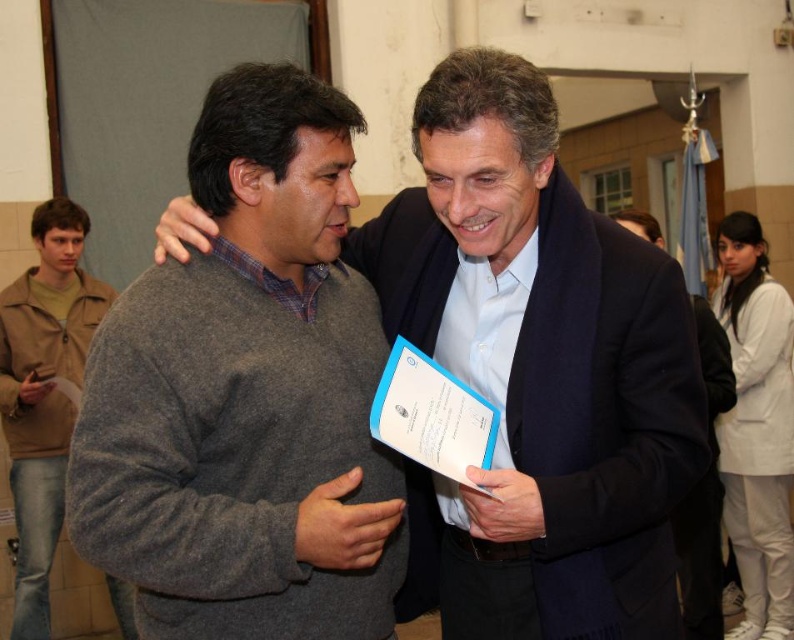
Question: Estimate the real-world distances between objects in this image. Which object is farther from the brown leather jacket at left?

Choices:
 (A) gray wool sweater at center
 (B) gray wool sweater at left

Answer: (A)

Question: Does gray wool sweater at left have a greater width compared to gray wool sweater at center?

Choices:
 (A) no
 (B) yes

Answer: (A)

Question: Does gray wool sweater at left have a greater width compared to brown leather jacket at left?

Choices:
 (A) no
 (B) yes

Answer: (B)

Question: Which is farther from the brown leather jacket at left?

Choices:
 (A) gray wool sweater at center
 (B) gray wool sweater at left

Answer: (A)

Question: Is gray wool sweater at center smaller than brown leather jacket at left?

Choices:
 (A) no
 (B) yes

Answer: (A)

Question: Which is nearer to the brown leather jacket at left?

Choices:
 (A) gray wool sweater at center
 (B) gray wool sweater at left

Answer: (B)